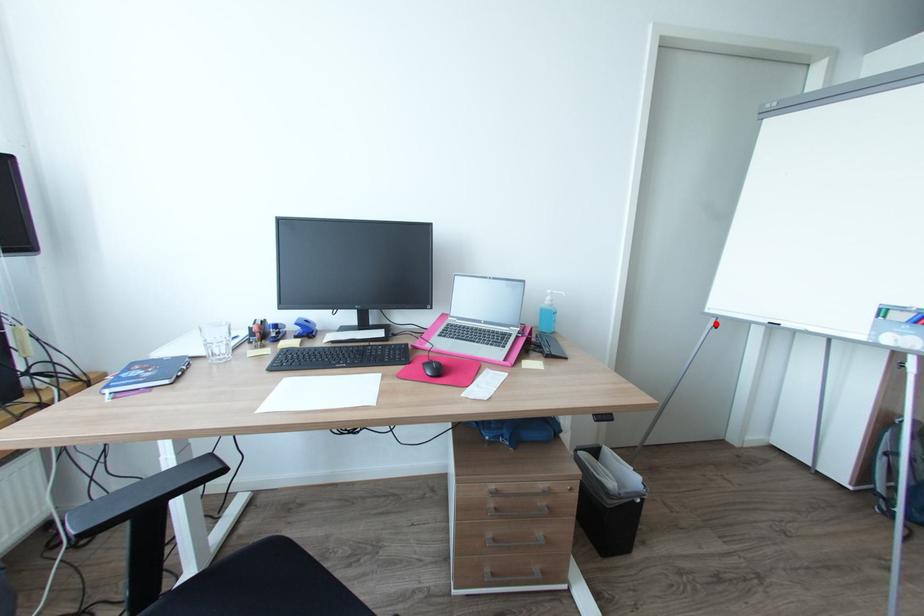
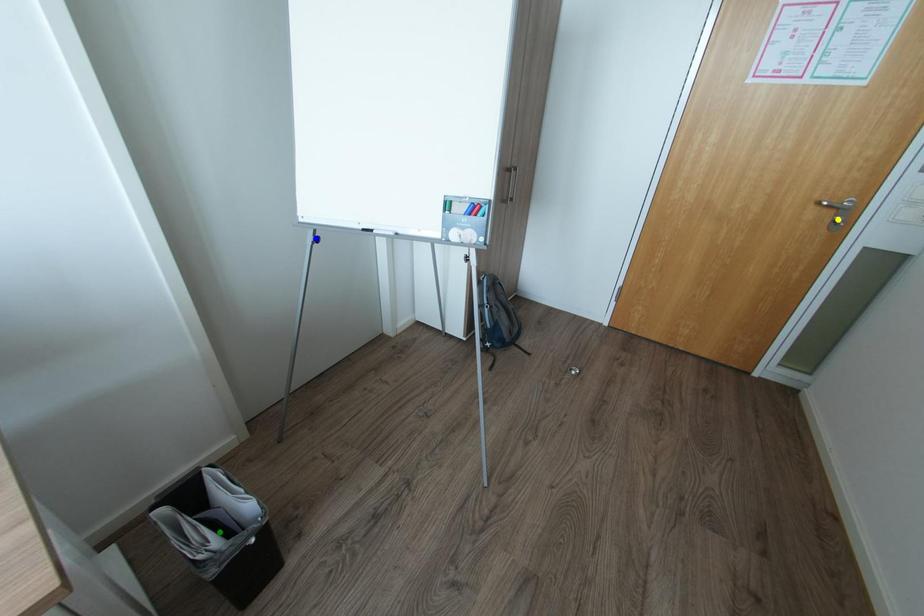
Question: I am providing you with two images of the same scene from different viewpoints. A red point is marked on the first image. You are given multiple points on the second image. Which spot in image 2 lines up with the point in image 1?

Choices:
 (A) green point
 (B) blue point
 (C) yellow point

Answer: (B)